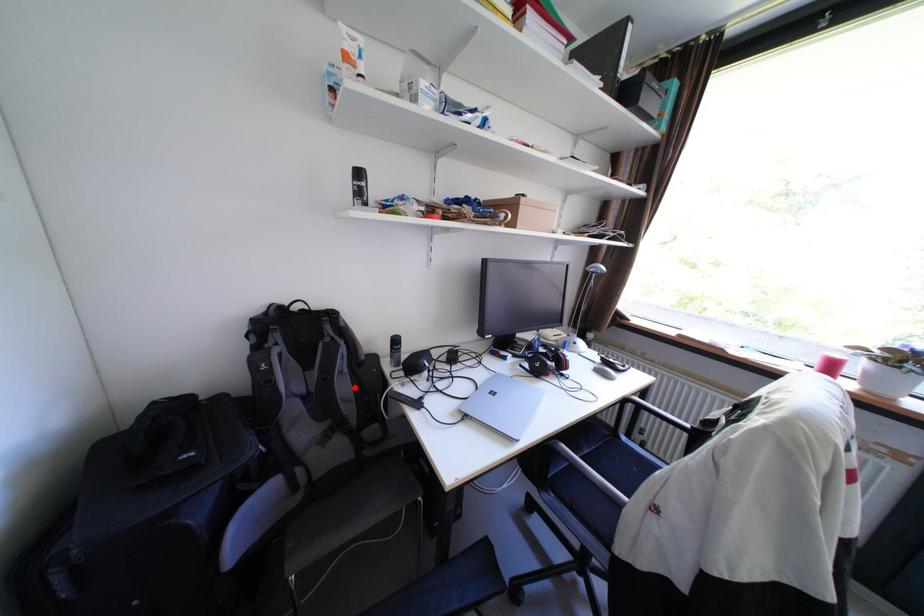
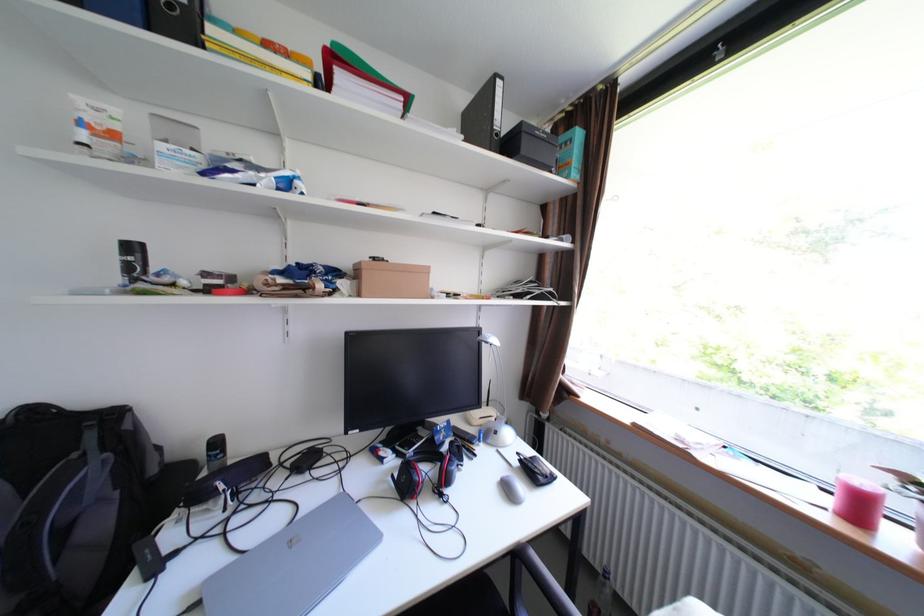
Locate, in the second image, the point that corresponds to the highlighted location in the first image.

(110, 524)